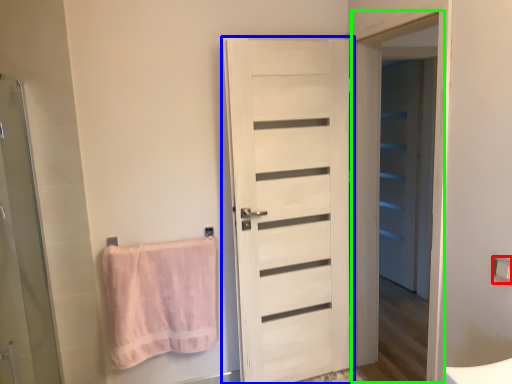
Question: Considering the real-world distances, which object is closest to towel bar (highlighted by a red box)? door (highlighted by a blue box) or screen door (highlighted by a green box).

Choices:
 (A) door
 (B) screen door

Answer: (B)